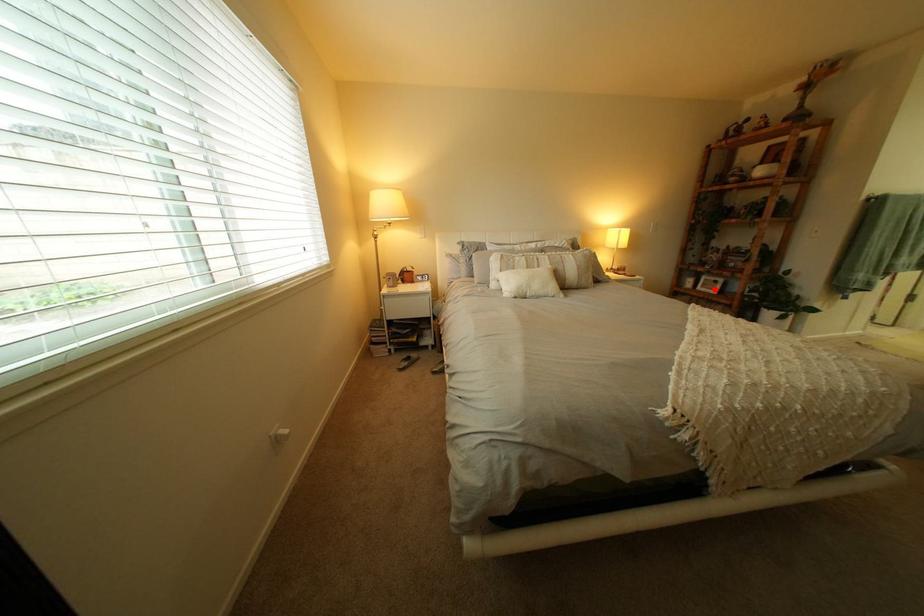
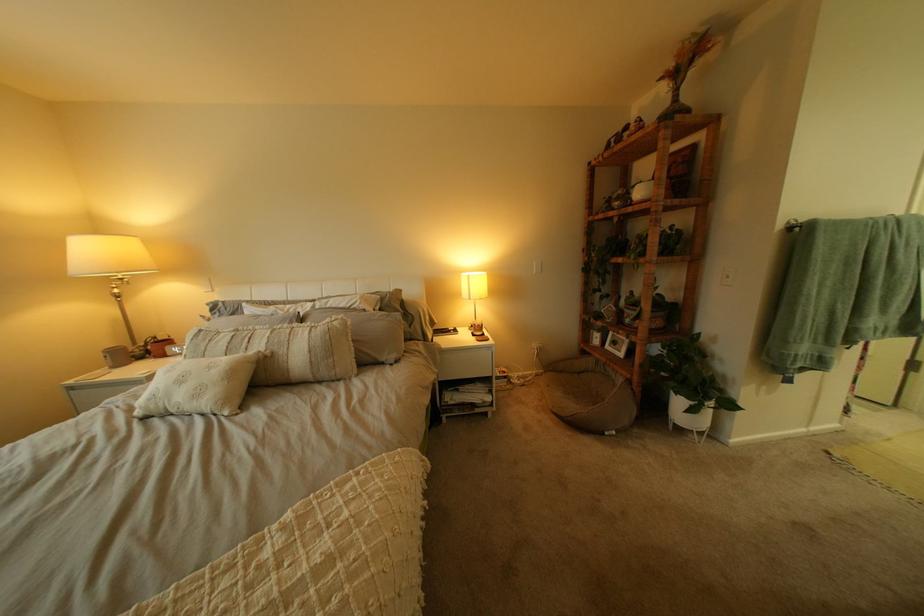
The point at the highlighted location is marked in the first image. Where is the corresponding point in the second image?

(623, 347)